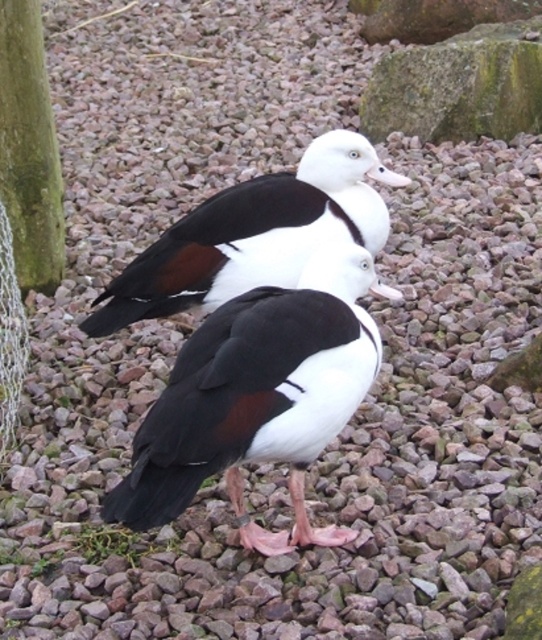
Question: Can you confirm if white glossy duck at center is positioned above white matte beak at center?

Choices:
 (A) no
 (B) yes

Answer: (B)

Question: Based on their relative distances, which object is nearer to the white matte beak at center?

Choices:
 (A) white glossy duck at center
 (B) black glossy duck at center
 (C) white glossy beak at upper center
 (D) green mossy tree trunk at left

Answer: (B)

Question: Which object is positioned farthest from the white matte beak at center?

Choices:
 (A) green mossy tree trunk at left
 (B) white glossy beak at upper center

Answer: (A)

Question: Does white glossy duck at center have a smaller size compared to white glossy beak at upper center?

Choices:
 (A) yes
 (B) no

Answer: (B)

Question: Does white glossy duck at center have a smaller size compared to green mossy tree trunk at left?

Choices:
 (A) yes
 (B) no

Answer: (B)

Question: Which point is closer to the camera?

Choices:
 (A) black glossy duck at center
 (B) white matte beak at center
 (C) green mossy tree trunk at left
 (D) white glossy duck at center

Answer: (A)